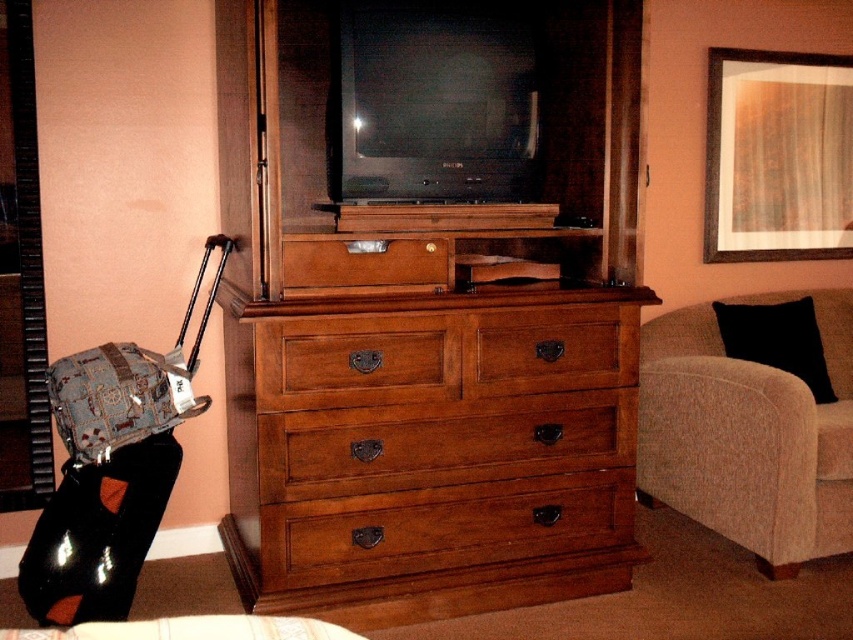
Can you confirm if brown wood drawer at center is positioned below matte black suitcase at left?

No.

Does brown wood drawer at center appear on the right side of matte black suitcase at left?

Correct, you'll find brown wood drawer at center to the right of matte black suitcase at left.

Who is more distant from viewer, (630, 376) or (305, 618)?

Point (630, 376)

At what (x,y) coordinates should I click in order to perform the action: click on brown wood drawer at center. Please return your answer as a coordinate pair (x, y). The width and height of the screenshot is (853, 640). Looking at the image, I should click on (550, 348).

Can you confirm if wooden dresser at center is shorter than brown wood drawer at center?

In fact, wooden dresser at center may be taller than brown wood drawer at center.

Is point (492, 432) behind point (563, 330)?

That is False.

Measure the distance between wooden dresser at center and camera.

2.06 meters

What are the coordinates of `wooden dresser at center` in the screenshot? It's located at (431, 304).

Can you confirm if beige fabric couch at right is smaller than wooden drawer at center?

No.

Is point (848, 484) behind point (339, 259)?

Yes.

Locate an element on the screen. The height and width of the screenshot is (640, 853). beige fabric couch at right is located at coordinates (749, 435).